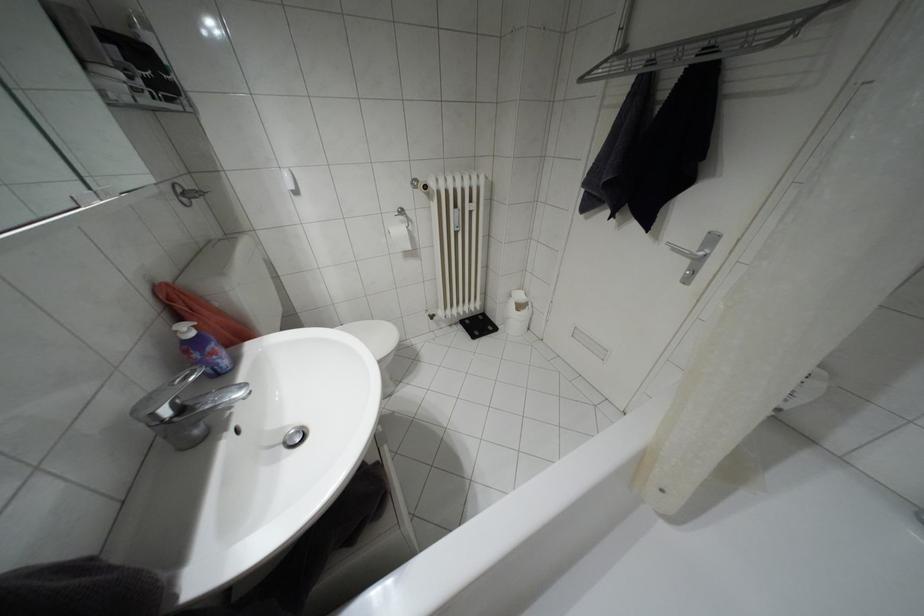
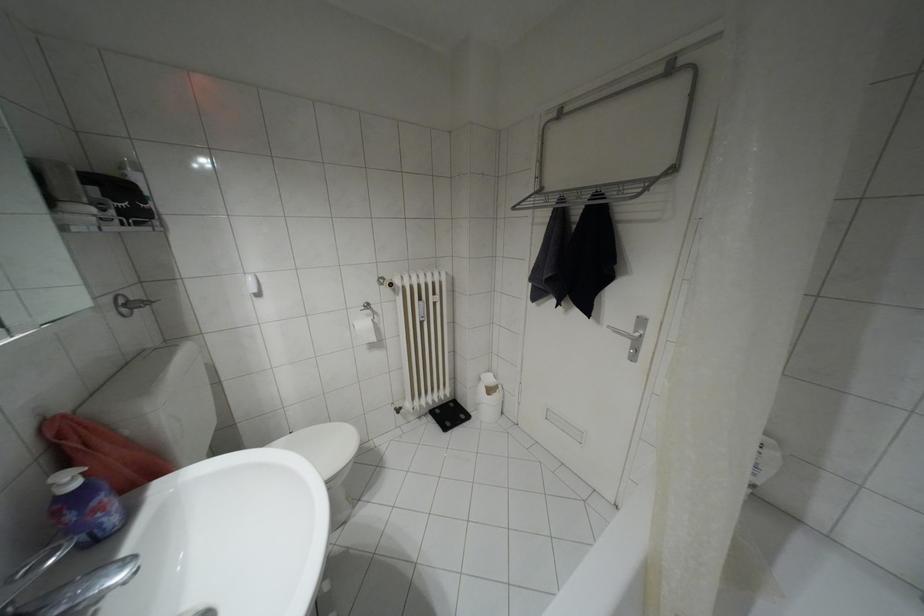
From the picture: In a continuous first-person perspective shot, in which direction is the camera moving?

The cameraman moved toward right, backward.